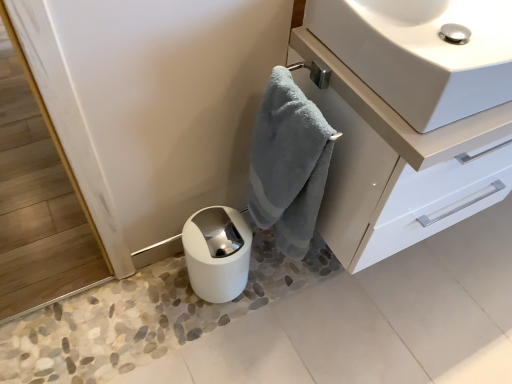
Find the location of a particular element. This screenshot has width=512, height=384. vacant space positioned to the left of white glossy paper towel at lower center is located at coordinates (159, 293).